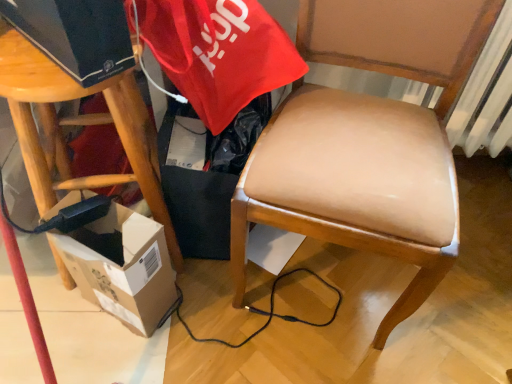
Image resolution: width=512 pixels, height=384 pixels. Find the location of `free space on the front side of wooden stool at left`. free space on the front side of wooden stool at left is located at coordinates (105, 350).